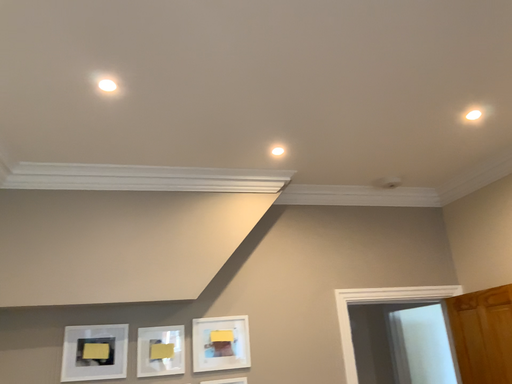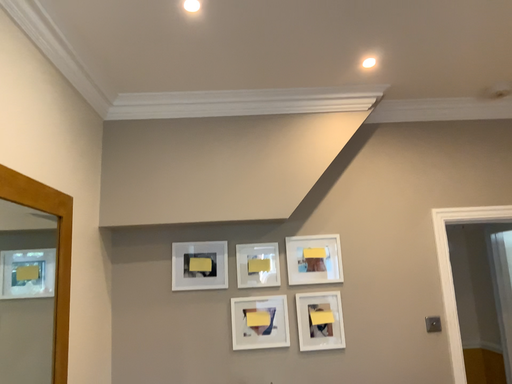
Question: How did the camera likely rotate when shooting the video?

Choices:
 (A) rotated left
 (B) rotated right

Answer: (A)